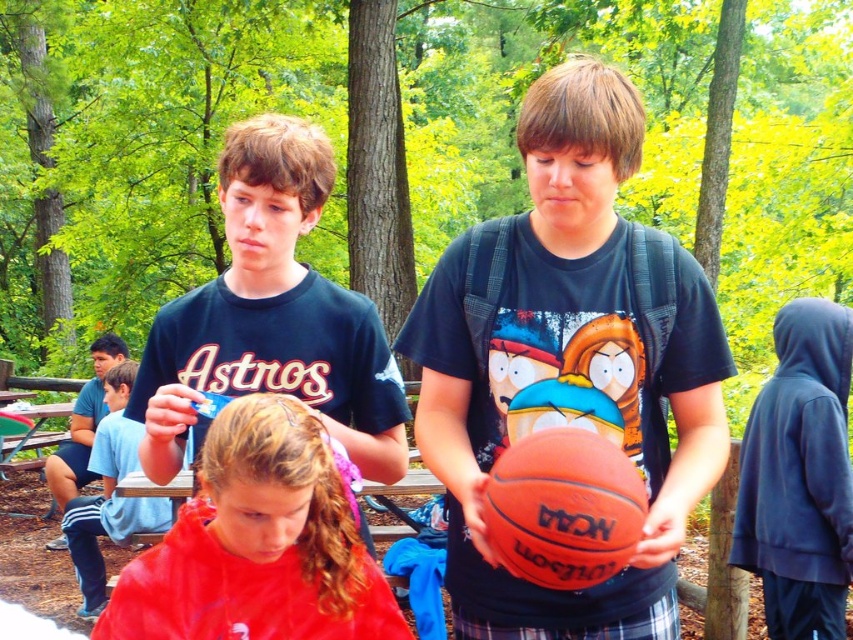
Question: Can you confirm if matte blue t-shirt at center is positioned below light blue cotton shirt at left?

Choices:
 (A) no
 (B) yes

Answer: (B)

Question: Is matte blue t-shirt at center to the left of light blue cotton shirt at left from the viewer's perspective?

Choices:
 (A) no
 (B) yes

Answer: (A)

Question: Which is farther from the rubber basketball at center?

Choices:
 (A) shiny red cape at center
 (B) matte black shirt at center
 (C) light blue cotton shirt at left

Answer: (C)

Question: Which object is closer to the camera taking this photo?

Choices:
 (A) orange matte basketball at center
 (B) rubber basketball at center
 (C) matte black shirt at center

Answer: (A)

Question: Which of these objects is positioned farthest from the rubber basketball at center?

Choices:
 (A) orange matte basketball at center
 (B) shiny red cape at center
 (C) matte black shirt at center
 (D) light blue cotton shirt at left

Answer: (D)

Question: Does rubber basketball at center appear under orange matte basketball at center?

Choices:
 (A) no
 (B) yes

Answer: (A)